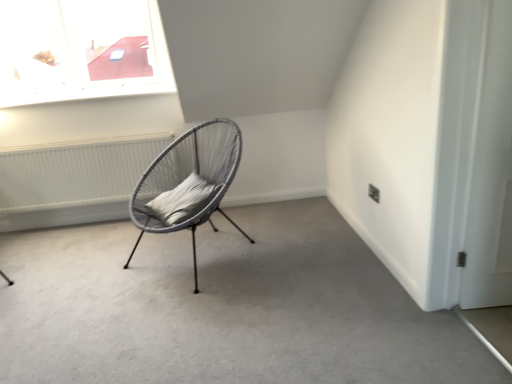
This screenshot has height=384, width=512. Find the location of `vacant location below white textured radiator at left (from a real-world perspective)`. vacant location below white textured radiator at left (from a real-world perspective) is located at coordinates (73, 219).